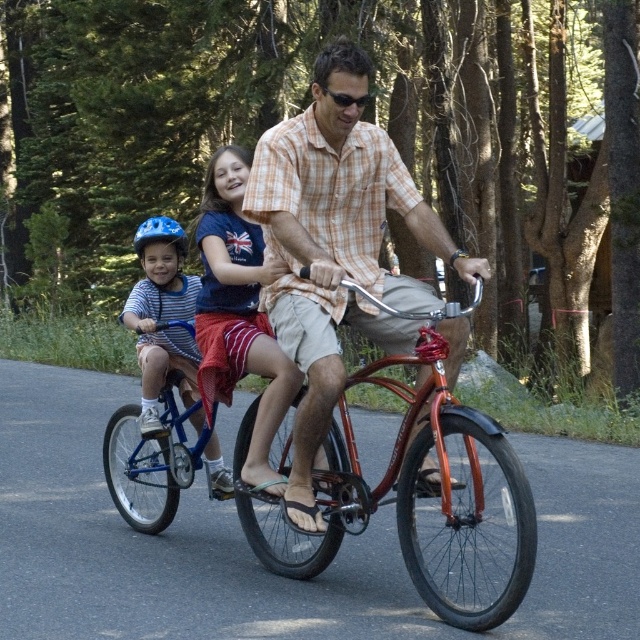
You are a photographer standing on the forest path. You want to take a photo of the matte orange shirt at center and the shiny metallic bicycle at center. Based on their positions, which object should you focus on first to ensure both are in focus?

The shiny metallic bicycle at center is behind the matte orange shirt at center, so you should focus on the matte orange shirt at center first to ensure both are in focus.

You are a photographer trying to capture a clear photo of the matte orange shirt at center and the shiny metallic bicycle at center. Which object will appear smaller in the photo?

The matte orange shirt at center will appear smaller in the photo because it occupies less space than the shiny metallic bicycle at center.